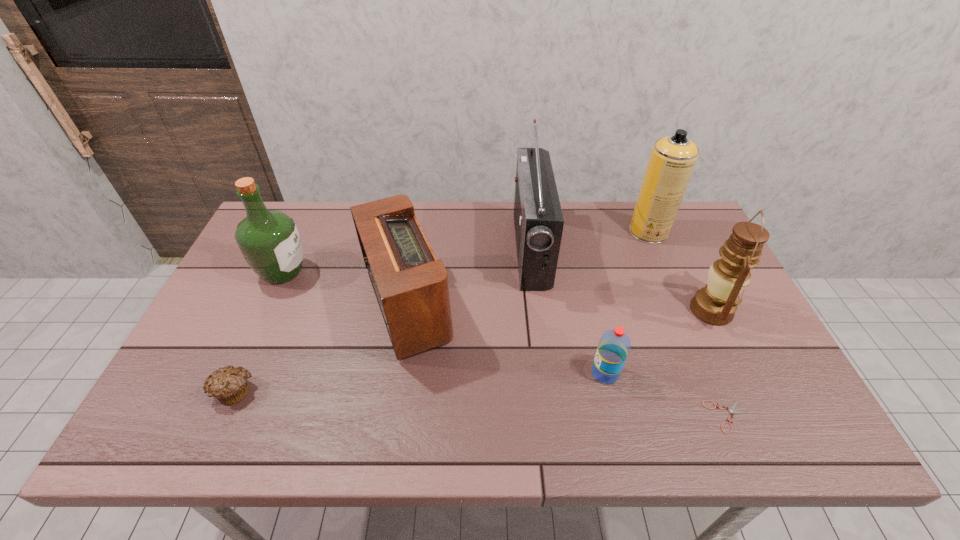
Image resolution: width=960 pixels, height=540 pixels. Identify the location of shears. (731, 410).

Locate an element on the screen. This screenshot has width=960, height=540. vacant space located on the front-facing side of the right radio receiver is located at coordinates (406, 250).

Where is `vacant space located 0.100m on the front-facing side of the right radio receiver`? vacant space located 0.100m on the front-facing side of the right radio receiver is located at coordinates (483, 250).

At what (x,y) coordinates should I click in order to perform the action: click on vacant space located on the front-facing side of the right radio receiver. Please return your answer as a coordinate pair (x, y). This screenshot has height=540, width=960. Looking at the image, I should click on (470, 250).

The width and height of the screenshot is (960, 540). Find the location of `free spot located 0.380m on the front of the aerosol can`. free spot located 0.380m on the front of the aerosol can is located at coordinates (695, 341).

Image resolution: width=960 pixels, height=540 pixels. In order to click on free location located 0.190m on the back of the oil lamp in this screenshot , I will do `click(680, 245)`.

Locate an element on the screen. vacant space located on the front-facing side of the liquor is located at coordinates (340, 272).

Find the location of `free spot located 0.180m on the left of the shorter radio receiver`. free spot located 0.180m on the left of the shorter radio receiver is located at coordinates (292, 306).

The height and width of the screenshot is (540, 960). Identify the location of free location located 0.260m on the front label of the fifth object from left to right. (483, 373).

The width and height of the screenshot is (960, 540). What are the coordinates of `free space located 0.130m on the front label of the fifth object from left to right` in the screenshot? It's located at (538, 373).